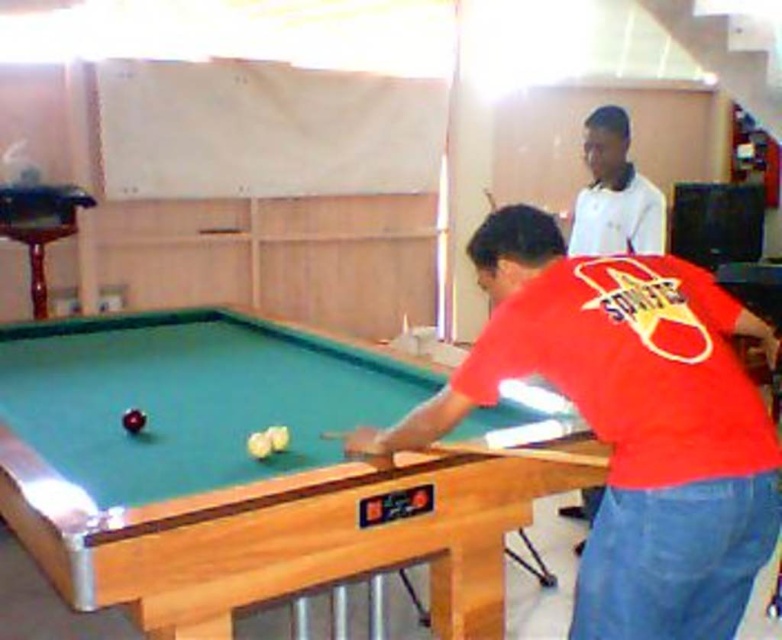
Question: Does green felt pool table at center appear on the left side of white smooth shirt at upper center?

Choices:
 (A) yes
 (B) no

Answer: (A)

Question: Which object is positioned closest to the green felt pool table at center?

Choices:
 (A) white smooth shirt at upper center
 (B) wooden smooth cue at center

Answer: (B)

Question: Considering the relative positions of green felt pool table at center and white smooth shirt at upper center in the image provided, where is green felt pool table at center located with respect to white smooth shirt at upper center?

Choices:
 (A) below
 (B) above

Answer: (A)

Question: Estimate the real-world distances between objects in this image. Which object is closer to the white smooth shirt at upper center?

Choices:
 (A) wooden smooth cue at center
 (B) red matte shirt at center

Answer: (A)

Question: Which point is farther to the camera?

Choices:
 (A) (687, 422)
 (B) (151, 468)

Answer: (B)

Question: Is red matte shirt at center below wooden smooth cue at center?

Choices:
 (A) yes
 (B) no

Answer: (B)